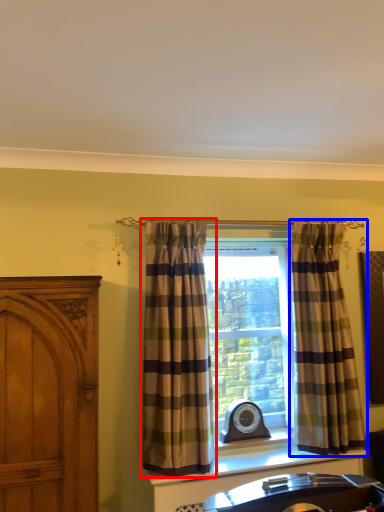
Question: Which object is further to the camera taking this photo, curtain (highlighted by a red box) or curtain (highlighted by a blue box)?

Choices:
 (A) curtain
 (B) curtain

Answer: (B)